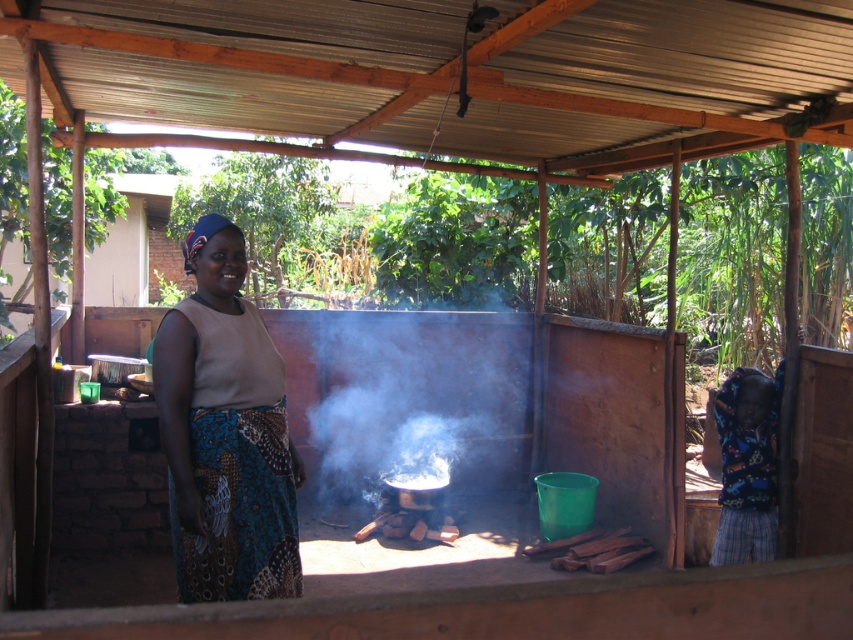
Is printed fabric skirt at center to the left of white smoke at center from the viewer's perspective?

Correct, you'll find printed fabric skirt at center to the left of white smoke at center.

Consider the image. Does printed fabric skirt at center have a greater width compared to white smoke at center?

No.

Is point (201, 548) closer to camera compared to point (465, 484)?

Yes, point (201, 548) is in front of point (465, 484).

Find the location of a particular element. printed fabric skirt at center is located at coordinates (225, 433).